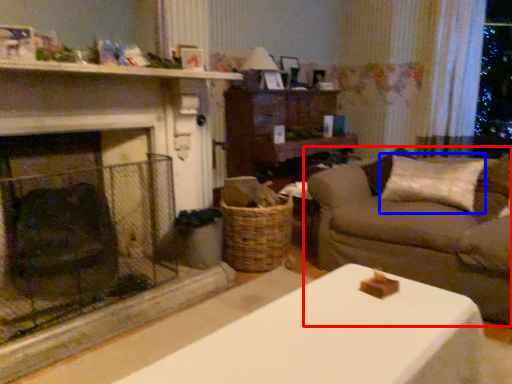
Question: Which point is further to the camera, studio couch (highlighted by a red box) or pillow (highlighted by a blue box)?

Choices:
 (A) studio couch
 (B) pillow

Answer: (B)